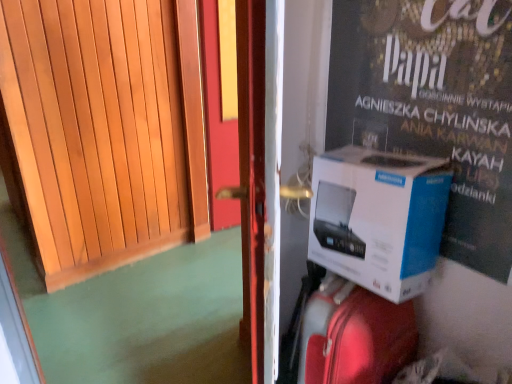
Where is `white cardboard box at right`? This screenshot has width=512, height=384. white cardboard box at right is located at coordinates (434, 106).

Based on their sizes in the image, would you say white cardboard box at right is bigger or smaller than wooden door at left?

In the image, white cardboard box at right appears to be smaller than wooden door at left.

Considering the sizes of objects white cardboard box at right and wooden door at left in the image provided, who is shorter, white cardboard box at right or wooden door at left?

white cardboard box at right is shorter.

From a real-world perspective, which object rests below the other?

wooden door at left.

Considering the relative sizes of shiny red suitcase at center and white cardboard box at right in the image provided, is shiny red suitcase at center thinner than white cardboard box at right?

No, shiny red suitcase at center is not thinner than white cardboard box at right.

Is shiny red suitcase at center at the right side of white cardboard box at right?

In fact, shiny red suitcase at center is to the left of white cardboard box at right.

Would you say shiny red suitcase at center contains white cardboard box at right?

Definitely not — white cardboard box at right is not inside shiny red suitcase at center.

Identify the location of box in front of the shiny red suitcase at center. The width and height of the screenshot is (512, 384). (378, 218).

Between point (352, 377) and point (132, 70), which one is positioned behind?

The point (132, 70) is farther.

From the image's perspective, between shiny red suitcase at center and wooden door at left, which one is located above?

From the image's view, wooden door at left is above.

From a real-world perspective, is shiny red suitcase at center beneath wooden door at left?

Yes, from a real-world perspective, shiny red suitcase at center is beneath wooden door at left.

Which object is further away from the camera taking this photo, shiny red suitcase at center or wooden door at left?

shiny red suitcase at center is more distant.

How far apart are wooden door at left and white cardboard box at right?

wooden door at left is 1.32 meters away from white cardboard box at right.

Is wooden door at left shorter than white cardboard box at right?

Incorrect, the height of wooden door at left does not fall short of that of white cardboard box at right.

Looking at their sizes, would you say wooden door at left is wider or thinner than white cardboard box at right?

wooden door at left is wider than white cardboard box at right.

Would you say white cardboard box at right is inside or outside white cardboard box at right?

white cardboard box at right is spatially situated outside white cardboard box at right.

From the image's perspective, which is below, white cardboard box at right or white cardboard box at right?

white cardboard box at right appears lower in the image.

Is white cardboard box at right shorter than white cardboard box at right?

Indeed, white cardboard box at right has a lesser height compared to white cardboard box at right.

Does white cardboard box at right turn towards white cardboard box at right?

Yes, white cardboard box at right faces towards white cardboard box at right.

Is white cardboard box at right next to white cardboard box at right?

white cardboard box at right and white cardboard box at right are clearly separated.

In the scene shown: Can you confirm if white cardboard box at right is bigger than white cardboard box at right?

Actually, white cardboard box at right might be smaller than white cardboard box at right.

The height and width of the screenshot is (384, 512). I want to click on advertisement above the white cardboard box at right (from the image's perspective), so click(434, 106).

Considering the positions of objects wooden door at left and white cardboard box at right in the image provided, who is more to the right, wooden door at left or white cardboard box at right?

white cardboard box at right.

Is point (49, 97) farther from viewer compared to point (316, 221)?

Yes, it is behind point (316, 221).

What's the angular difference between wooden door at left and white cardboard box at right's facing directions?

The angle between the facing direction of wooden door at left and the facing direction of white cardboard box at right is 89.9 degrees.

This screenshot has height=384, width=512. I want to click on box behind the wooden door at left, so click(378, 218).

This screenshot has width=512, height=384. I want to click on box in front of the shiny red suitcase at center, so click(378, 218).

Looking at the image, which one is located further to white cardboard box at right, shiny red suitcase at center or white cardboard box at right?

Among the two, white cardboard box at right is located further to white cardboard box at right.

Considering their positions, is shiny red suitcase at center positioned further to wooden door at left than white cardboard box at right?

shiny red suitcase at center is positioned further to the anchor wooden door at left.

When comparing their distances from shiny red suitcase at center, does white cardboard box at right or white cardboard box at right seem closer?

white cardboard box at right lies closer to shiny red suitcase at center than the other object.

From the image, which object appears to be nearer to white cardboard box at right, white cardboard box at right or wooden door at left?

Among the two, white cardboard box at right is located nearer to white cardboard box at right.

Considering their positions, is shiny red suitcase at center positioned further to wooden door at left than white cardboard box at right?

shiny red suitcase at center lies further to wooden door at left than the other object.

From the image, which object appears to be farther from white cardboard box at right, shiny red suitcase at center or wooden door at left?

The object further to white cardboard box at right is wooden door at left.

When comparing their distances from white cardboard box at right, does shiny red suitcase at center or white cardboard box at right seem further?

Among the two, shiny red suitcase at center is located further to white cardboard box at right.

Looking at the image, which one is located further to white cardboard box at right, white cardboard box at right or wooden door at left?

Based on the image, wooden door at left appears to be further to white cardboard box at right.

I want to click on suitcase between wooden door at left and white cardboard box at right from left to right, so click(354, 336).

Where is `box situated between wooden door at left and white cardboard box at right from left to right`? The image size is (512, 384). box situated between wooden door at left and white cardboard box at right from left to right is located at coordinates (378, 218).

This screenshot has width=512, height=384. I want to click on box between white cardboard box at right and shiny red suitcase at center in the up-down direction, so click(x=378, y=218).

Where is `suitcase between wooden door at left and white cardboard box at right in the horizontal direction`? The width and height of the screenshot is (512, 384). suitcase between wooden door at left and white cardboard box at right in the horizontal direction is located at coordinates (354, 336).